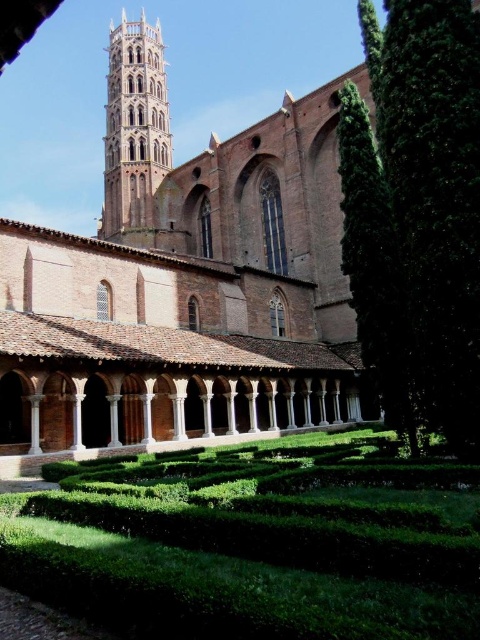
Which is above, green hedge maze at lower center or green leafy hedge at right?

Positioned higher is green leafy hedge at right.

Does point (207, 563) come in front of point (436, 406)?

Yes, point (207, 563) is in front of point (436, 406).

The height and width of the screenshot is (640, 480). I want to click on green hedge maze at lower center, so click(255, 541).

Is green leafy hedge at right closer to camera compared to brown brick tower at upper left?

Yes, it is in front of brown brick tower at upper left.

Between point (415, 248) and point (110, 122), which one is positioned in front?

Positioned in front is point (415, 248).

Identify the location of green leafy hedge at right. This screenshot has height=640, width=480. (433, 189).

Is green hedge maze at lower center positioned behind brown brick tower at upper left?

No.

Is green hedge maze at lower center below brown brick tower at upper left?

Correct, green hedge maze at lower center is located below brown brick tower at upper left.

Is point (298, 586) farther from camera compared to point (141, 109)?

No.

What are the coordinates of `green hedge maze at lower center` in the screenshot? It's located at (255, 541).